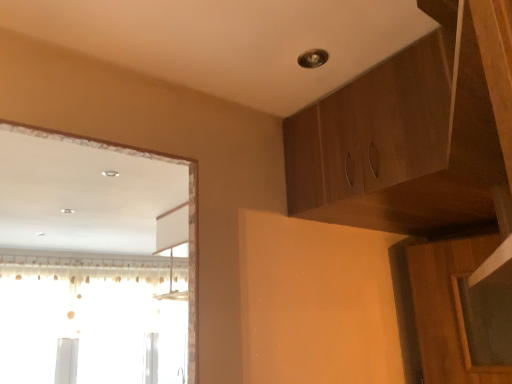
Question: Considering their positions, is wooden cabinet at upper right located in front of or behind translucent fabric curtain at left?

Choices:
 (A) front
 (B) behind

Answer: (A)

Question: Considering the relative positions of wooden cabinet at upper right and translucent fabric curtain at left in the image provided, is wooden cabinet at upper right to the left or to the right of translucent fabric curtain at left?

Choices:
 (A) left
 (B) right

Answer: (B)

Question: Considering the positions of wooden cabinet at upper right and translucent fabric curtain at left in the image, is wooden cabinet at upper right taller or shorter than translucent fabric curtain at left?

Choices:
 (A) tall
 (B) short

Answer: (B)

Question: Would you say translucent fabric curtain at left is to the left or to the right of wooden cabinet at upper right in the picture?

Choices:
 (A) left
 (B) right

Answer: (A)

Question: Based on their sizes in the image, would you say translucent fabric curtain at left is bigger or smaller than wooden cabinet at upper right?

Choices:
 (A) big
 (B) small

Answer: (A)

Question: From the image's perspective, is translucent fabric curtain at left located above or below wooden cabinet at upper right?

Choices:
 (A) below
 (B) above

Answer: (A)

Question: Looking at their shapes, would you say translucent fabric curtain at left is wider or thinner than wooden cabinet at upper right?

Choices:
 (A) wide
 (B) thin

Answer: (B)